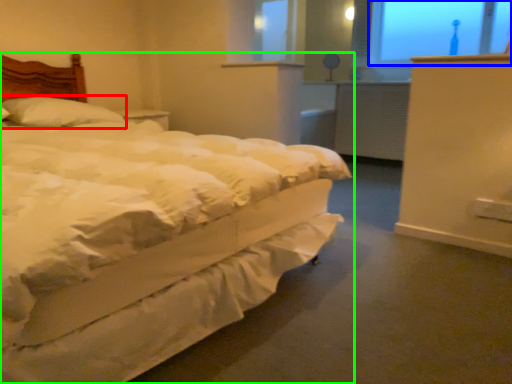
Question: Which is farther away from pillow (highlighted by a red box)? window screen (highlighted by a blue box) or bed (highlighted by a green box)?

Choices:
 (A) window screen
 (B) bed

Answer: (A)